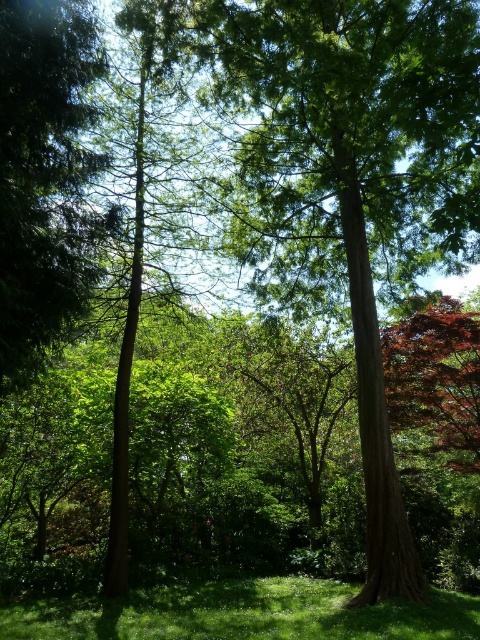
Question: Which object appears farthest from the camera in this image?

Choices:
 (A) green leafy tree at left
 (B) green grassy at lower center

Answer: (B)

Question: Is green leafy tree at left smaller than green grassy at lower center?

Choices:
 (A) no
 (B) yes

Answer: (B)

Question: Among these objects, which one is farthest from the camera?

Choices:
 (A) green leafy tree at left
 (B) green grassy at lower center

Answer: (B)

Question: Can you confirm if green leafy tree at left is smaller than green grassy at lower center?

Choices:
 (A) yes
 (B) no

Answer: (A)

Question: Considering the relative positions of green leafy tree at left and green grassy at lower center in the image provided, where is green leafy tree at left located with respect to green grassy at lower center?

Choices:
 (A) below
 (B) above

Answer: (B)

Question: Which point appears closest to the camera in this image?

Choices:
 (A) (29, 284)
 (B) (241, 579)

Answer: (A)